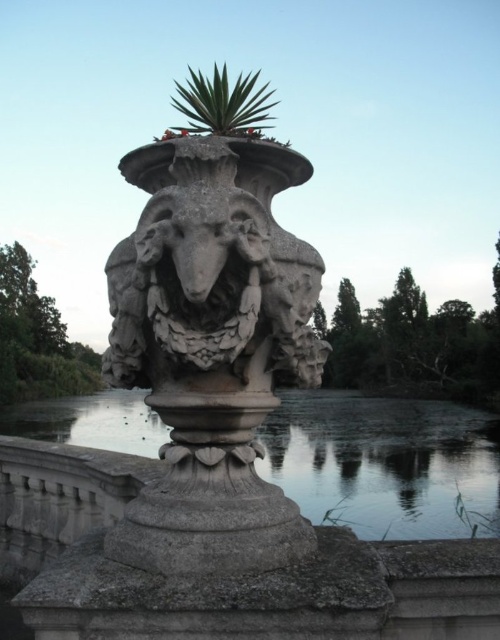
You are an architect designing a miniature garden and need to place both the transparent water at base center and the green leafy plant at center. Given their sizes, which one should you prioritize placing first to ensure proper spacing?

The transparent water at base center has a larger size compared to the green leafy plant at center, so you should prioritize placing the transparent water at base center first to ensure proper spacing.

You are standing at the viewpoint of the image and see two points marked in the scene. Which point, point (385,422) or point (237,99), is closer to you?

Point (237,99) is closer to you because it is in front of point (385,422).

You are a gardener who wants to place a new decorative item between the transparent water at base center and the green leafy plant at top. Given their widths, which object should you place the item closer to to ensure it doesn

The transparent water at base center is wider than the green leafy plant at top, so placing the new item closer to the transparent water at base center would provide more space.